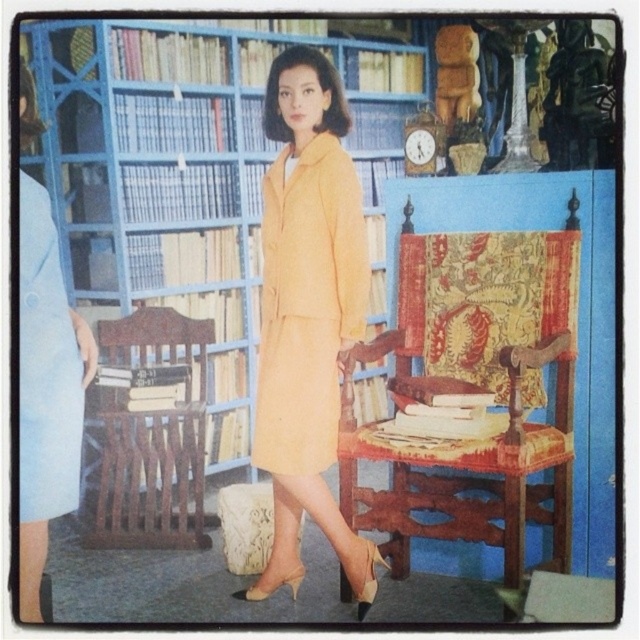
Does matte yellow suit at center lie behind matte yellow dress at center?

Yes.

Can you confirm if matte yellow suit at center is bigger than matte yellow dress at center?

Correct, matte yellow suit at center is larger in size than matte yellow dress at center.

What do you see at coordinates (307, 314) in the screenshot? This screenshot has width=640, height=640. I see `matte yellow suit at center` at bounding box center [307, 314].

Identify the location of matte yellow suit at center. The image size is (640, 640). (307, 314).

Who is lower down, wooden armchair with patterned upholstery at center or matte yellow dress at center?

wooden armchair with patterned upholstery at center

Is wooden armchair with patterned upholstery at center to the right of matte yellow dress at center from the viewer's perspective?

Correct, you'll find wooden armchair with patterned upholstery at center to the right of matte yellow dress at center.

Is point (458, 481) less distant than point (268, 209)?

No, it is not.

Locate an element on the screen. wooden armchair with patterned upholstery at center is located at coordinates (476, 388).

Is wooden armchair with patterned upholstery at center taller than matte yellow suit at center?

In fact, wooden armchair with patterned upholstery at center may be shorter than matte yellow suit at center.

The width and height of the screenshot is (640, 640). Describe the element at coordinates (476, 388) in the screenshot. I see `wooden armchair with patterned upholstery at center` at that location.

Where is `wooden armchair with patterned upholstery at center`? The image size is (640, 640). wooden armchair with patterned upholstery at center is located at coordinates (476, 388).